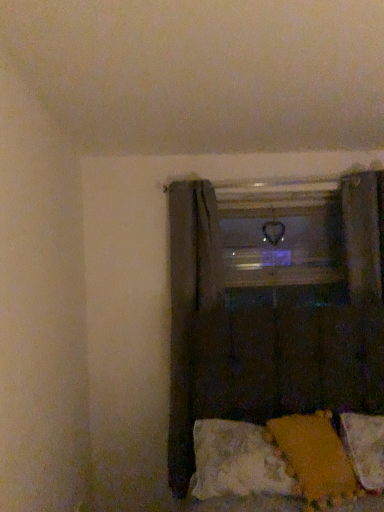
Question: Considering the relative sizes of dark fabric curtain at center, which is the second curtain in front-to-back order, and white soft pillow at lower right, the 1th pillow in the right-to-left sequence, in the image provided, is dark fabric curtain at center, which is the second curtain in front-to-back order, shorter than white soft pillow at lower right, the 1th pillow in the right-to-left sequence,?

Choices:
 (A) yes
 (B) no

Answer: (B)

Question: Can we say dark fabric curtain at center, which is the second curtain in front-to-back order, lies outside white soft pillow at lower right, which is the second pillow from left to right?

Choices:
 (A) no
 (B) yes

Answer: (B)

Question: Is dark fabric curtain at center, which ranks as the first curtain in back-to-front order, aimed at white soft pillow at lower right, the 1th pillow in the right-to-left sequence?

Choices:
 (A) no
 (B) yes

Answer: (A)

Question: Could white soft pillow at lower right, which is the second pillow from left to right, be considered to be inside dark fabric curtain at center, which is the second curtain in front-to-back order?

Choices:
 (A) no
 (B) yes

Answer: (A)

Question: From a real-world perspective, is dark fabric curtain at center, which ranks as the first curtain in back-to-front order, located beneath white soft pillow at lower right, which is the second pillow from left to right?

Choices:
 (A) yes
 (B) no

Answer: (B)

Question: Can you confirm if dark fabric curtain at center, which is the second curtain in front-to-back order, is bigger than white soft pillow at lower right, which is the second pillow from left to right?

Choices:
 (A) yes
 (B) no

Answer: (A)

Question: From a real-world perspective, does velvety orange pillow at lower right, positioned as the first pillow in left-to-right order, sit lower than white soft pillow at lower right, the 1th pillow in the right-to-left sequence?

Choices:
 (A) yes
 (B) no

Answer: (B)

Question: Considering the relative sizes of velvety orange pillow at lower right, acting as the 2th pillow starting from the right, and white soft pillow at lower right, which is the second pillow from left to right, in the image provided, is velvety orange pillow at lower right, acting as the 2th pillow starting from the right, wider than white soft pillow at lower right, which is the second pillow from left to right,?

Choices:
 (A) no
 (B) yes

Answer: (A)

Question: Considering the relative sizes of velvety orange pillow at lower right, positioned as the first pillow in left-to-right order, and white soft pillow at lower right, the 1th pillow in the right-to-left sequence, in the image provided, is velvety orange pillow at lower right, positioned as the first pillow in left-to-right order, thinner than white soft pillow at lower right, the 1th pillow in the right-to-left sequence,?

Choices:
 (A) yes
 (B) no

Answer: (A)

Question: Is white soft pillow at lower right, the 1th pillow in the right-to-left sequence, surrounded by velvety orange pillow at lower right, positioned as the first pillow in left-to-right order?

Choices:
 (A) yes
 (B) no

Answer: (B)

Question: Is velvety orange pillow at lower right, positioned as the first pillow in left-to-right order, positioned before white soft pillow at lower right, which is the second pillow from left to right?

Choices:
 (A) yes
 (B) no

Answer: (A)

Question: Can you confirm if velvety orange pillow at lower right, acting as the 2th pillow starting from the right, is positioned to the left of white soft pillow at lower right, which is the second pillow from left to right?

Choices:
 (A) yes
 (B) no

Answer: (A)

Question: Is dark fabric curtain at center, which is the second curtain in front-to-back order, in front of transparent glass window frame at center?

Choices:
 (A) no
 (B) yes

Answer: (B)